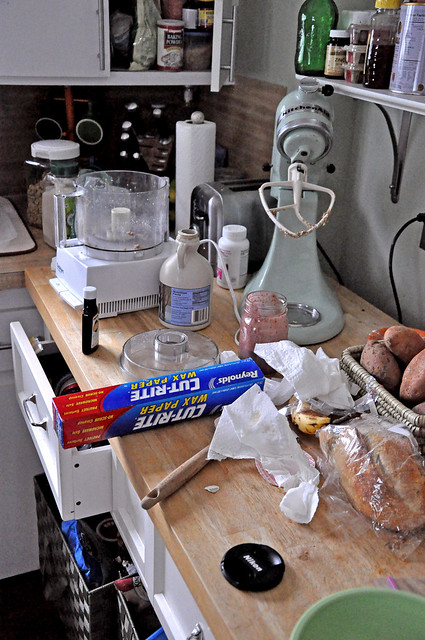
Where is `wooden tabletop`? Image resolution: width=425 pixels, height=640 pixels. wooden tabletop is located at coordinates (329, 552).